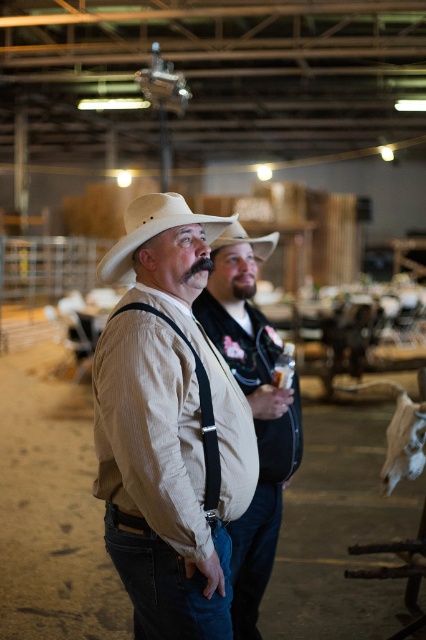
Is the position of tan corduroy shirt at center more distant than that of white matte cowboy hat at center?

No, tan corduroy shirt at center is in front of white matte cowboy hat at center.

What do you see at coordinates (166, 428) in the screenshot? I see `tan corduroy shirt at center` at bounding box center [166, 428].

At what (x,y) coordinates should I click in order to perform the action: click on tan corduroy shirt at center. Please return your answer as a coordinate pair (x, y). The height and width of the screenshot is (640, 426). Looking at the image, I should click on (166, 428).

Between point (112, 248) and point (115, 282), which one is positioned in front?

Point (112, 248)

Does tan corduroy shirt at center have a lesser width compared to beige felt cowboy hat at center?

No, tan corduroy shirt at center is not thinner than beige felt cowboy hat at center.

This screenshot has height=640, width=426. What do you see at coordinates (166, 428) in the screenshot?
I see `tan corduroy shirt at center` at bounding box center [166, 428].

Where is `tan corduroy shirt at center`? tan corduroy shirt at center is located at coordinates (166, 428).

Who is higher up, matte beige shirt at center or white matte cowboy hat at center?

white matte cowboy hat at center is above.

Locate an element on the screen. matte beige shirt at center is located at coordinates (252, 410).